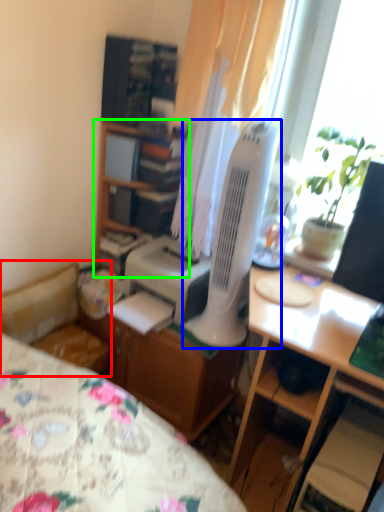
Question: Which object is positioned closest to studio couch (highlighted by a red box)? Select from mechanical fan (highlighted by a blue box) and cabinetry (highlighted by a green box).

Choices:
 (A) mechanical fan
 (B) cabinetry

Answer: (B)